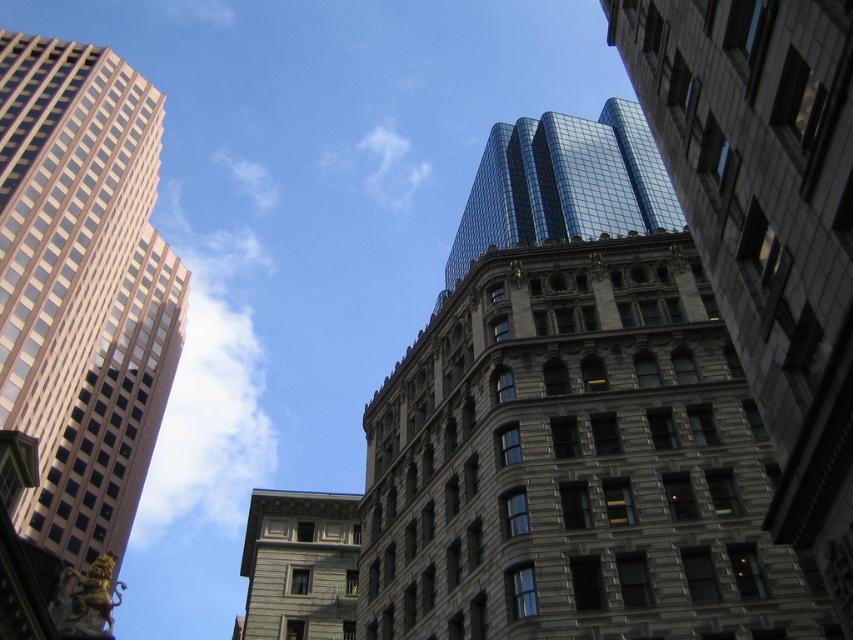
Does shiny glass skyscraper at upper center have a greater width compared to gray stone building at center?

No, shiny glass skyscraper at upper center is not wider than gray stone building at center.

How far apart are shiny glass skyscraper at upper center and gray stone building at center?

shiny glass skyscraper at upper center and gray stone building at center are 314.07 feet apart.

Is point (660, 220) positioned after point (346, 512)?

Yes, point (660, 220) is behind point (346, 512).

This screenshot has width=853, height=640. Find the location of `shiny glass skyscraper at upper center`. shiny glass skyscraper at upper center is located at coordinates (564, 184).

Is point (93, 68) positioned before point (639, 170)?

Yes, it is in front of point (639, 170).

Does matte glass skyscraper at left have a smaller size compared to shiny glass skyscraper at upper center?

Yes, matte glass skyscraper at left is smaller than shiny glass skyscraper at upper center.

What do you see at coordinates (82, 288) in the screenshot?
I see `matte glass skyscraper at left` at bounding box center [82, 288].

Identify the location of matte glass skyscraper at left. (x=82, y=288).

Is matte glass skyscraper at left below gray stone building at center?

No.

Between matte glass skyscraper at left and gray stone building at center, which one has less height?

matte glass skyscraper at left is shorter.

Find the location of a particular element. The image size is (853, 640). matte glass skyscraper at left is located at coordinates (82, 288).

Locate an element on the screen. matte glass skyscraper at left is located at coordinates (82, 288).